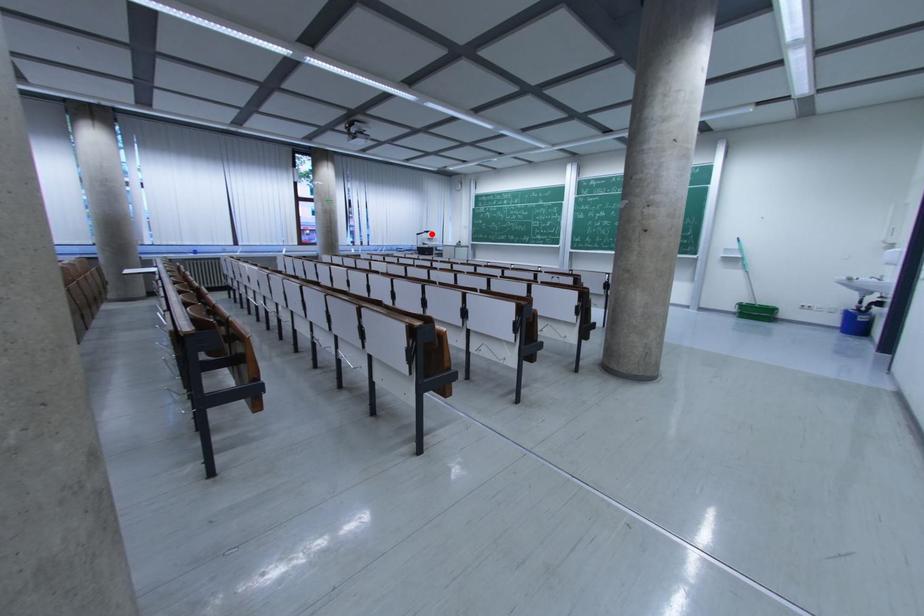
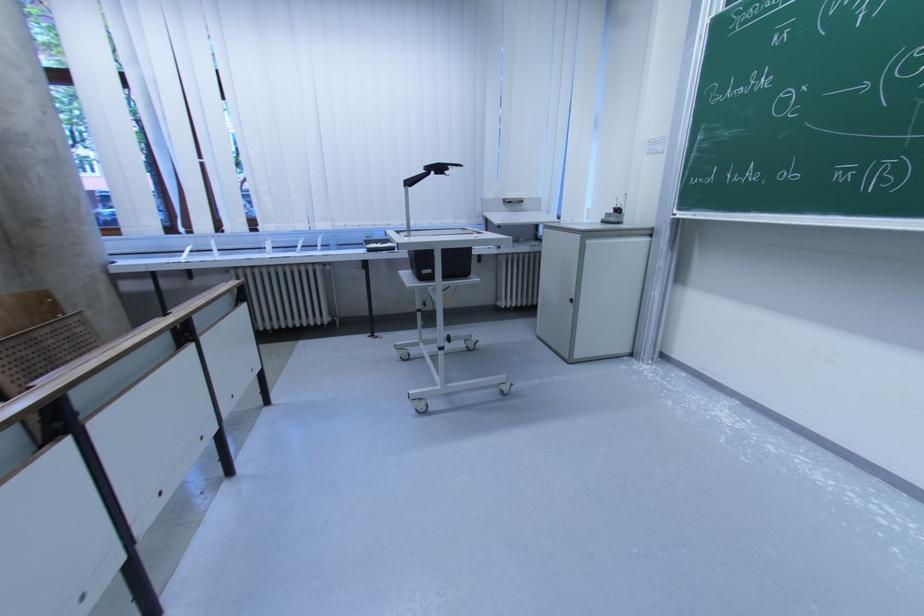
Question: I am providing you with two images of the same scene from different viewpoints. In image1, a red point is highlighted. Considering the same 3D point in image2, which of the following is correct?

Choices:
 (A) It is closer
 (B) It is farther

Answer: (B)